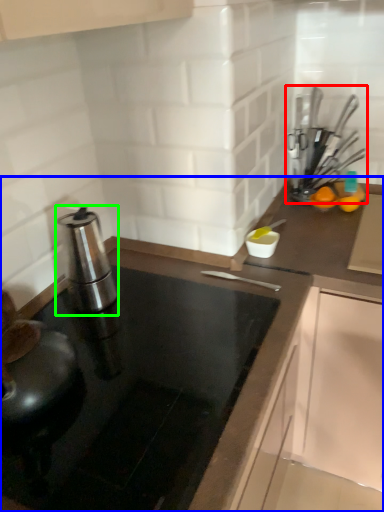
Question: Based on their relative distances, which object is farther from kitchen appliance (highlighted by a red box)? Choose from countertop (highlighted by a blue box) and kitchen appliance (highlighted by a green box).

Choices:
 (A) countertop
 (B) kitchen appliance

Answer: (B)